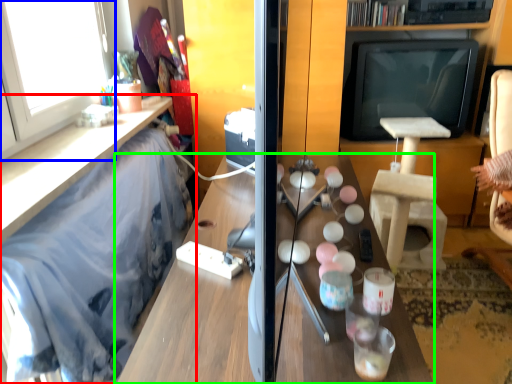
Question: Which is farther away from furniture (highlighted by a red box)? window (highlighted by a blue box) or table (highlighted by a green box)?

Choices:
 (A) window
 (B) table

Answer: (B)